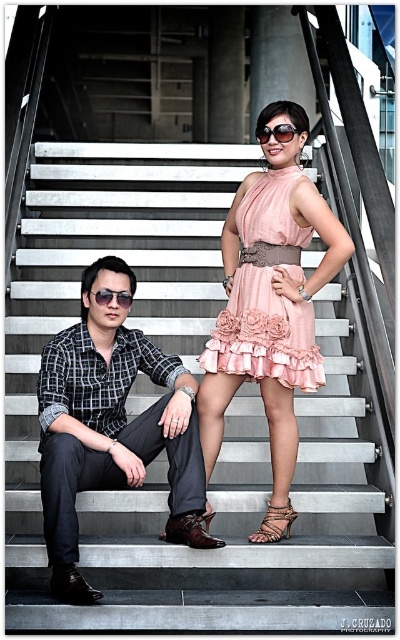
Question: Considering the real-world distances, which object is closest to the shiny black sunglasses at left?

Choices:
 (A) brown leather sandal at lower center
 (B) sunglasses at center

Answer: (B)

Question: Which of the following is the closest to the observer?

Choices:
 (A) tap(174, 522)
 (B) tap(330, 253)
 (C) tap(74, 566)

Answer: (C)

Question: Does brown leather sandal at center have a larger size compared to sunglasses at center?

Choices:
 (A) no
 (B) yes

Answer: (A)

Question: Is pink satin dress at center thinner than sunglasses at center?

Choices:
 (A) yes
 (B) no

Answer: (B)

Question: Is checkered fabric shirt at left above shiny black sunglasses at left?

Choices:
 (A) no
 (B) yes

Answer: (A)

Question: Which of these objects is positioned farthest from the checkered fabric shirt at left?

Choices:
 (A) brown leather sandal at center
 (B) brown leather sandal at lower center
 (C) shiny black sunglasses at left

Answer: (A)